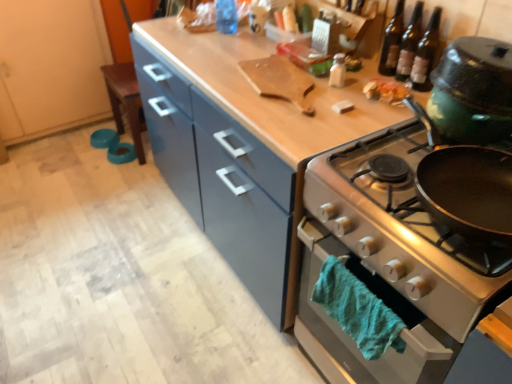
Find the location of `spots to the right of transparent plastic bottle at upper center, acting as the first bottle starting from the left`. spots to the right of transparent plastic bottle at upper center, acting as the first bottle starting from the left is located at coordinates (249, 35).